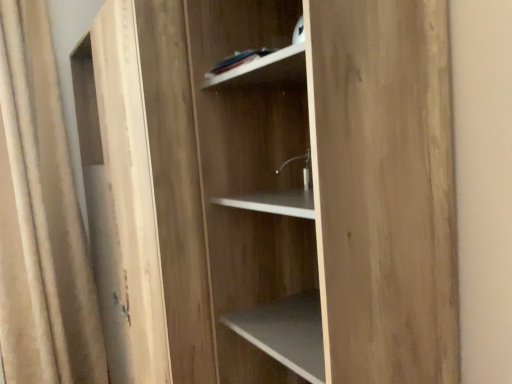
Image resolution: width=512 pixels, height=384 pixels. Find the location of `light wood cabinet at center`. light wood cabinet at center is located at coordinates (257, 193).

From a real-world perspective, is beige fabric curtain at left positioned above or below light wood cabinet at center?

beige fabric curtain at left is situated higher than light wood cabinet at center in the real world.

From the image's perspective, is beige fabric curtain at left on top of light wood cabinet at center?

Correct, beige fabric curtain at left appears higher than light wood cabinet at center in the image.

Does beige fabric curtain at left turn towards light wood cabinet at center?

No.

From the picture: Considering the sizes of objects beige fabric curtain at left and light wood cabinet at center in the image provided, who is taller, beige fabric curtain at left or light wood cabinet at center?

With more height is beige fabric curtain at left.

Find the location of `cabinet above the light wood cabinet at center (from a real-world perspective)`. cabinet above the light wood cabinet at center (from a real-world perspective) is located at coordinates (265, 71).

Is white matte shelf at upper center not within light wood cabinet at center?

white matte shelf at upper center lies outside light wood cabinet at center's area.

From the image's perspective, between white matte shelf at upper center and light wood cabinet at center, which one is located above?

From the image's view, white matte shelf at upper center is above.

Is white matte shelf at upper center far away from light wood cabinet at center?

Actually, white matte shelf at upper center and light wood cabinet at center are a little close together.

Is the position of light wood cabinet at center more distant than that of beige fabric curtain at left?

That is False.

Identify the location of cabinetry in front of the beige fabric curtain at left. (257, 193).

Between point (239, 353) and point (35, 201), which one is positioned behind?

The point (35, 201) is farther from the camera.

Considering the positions of objects light wood cabinet at center and beige fabric curtain at left in the image provided, who is more to the right, light wood cabinet at center or beige fabric curtain at left?

Positioned to the right is light wood cabinet at center.

Does light brown wood at center turn towards light wood cabinet at center?

No, light brown wood at center is not facing towards light wood cabinet at center.

Considering the relative sizes of light brown wood at center and light wood cabinet at center in the image provided, is light brown wood at center shorter than light wood cabinet at center?

Yes.

Is point (415, 336) farther from camera compared to point (247, 110)?

No, it is not.

Is white matte shelf at upper center behind beige fabric curtain at left?

No.

Is white matte shelf at upper center beside beige fabric curtain at left?

No.

Considering the relative sizes of beige fabric curtain at left and light brown wood at center in the image provided, is beige fabric curtain at left wider than light brown wood at center?

No.

From the image's perspective, is beige fabric curtain at left on light brown wood at center?

Incorrect, from the image's perspective, beige fabric curtain at left is lower than light brown wood at center.

This screenshot has height=384, width=512. In order to click on curtain that appears above the light brown wood at center (from a real-world perspective) in this screenshot , I will do click(42, 217).

Is beige fabric curtain at left next to light brown wood at center and touching it?

No, beige fabric curtain at left is not next to light brown wood at center.

Is light wood cabinet at center positioned with its back to light brown wood at center?

No, light wood cabinet at center's orientation is not away from light brown wood at center.

Is light wood cabinet at center positioned beyond the bounds of light brown wood at center?

Yes, light wood cabinet at center is not within light brown wood at center.

Which object is thinner, light wood cabinet at center or light brown wood at center?

light brown wood at center.

From a real-world perspective, which object rests below the other?

In real-world perspective, light wood cabinet at center is lower.

Locate an element on the screen. The width and height of the screenshot is (512, 384). curtain that appears on the left of light wood cabinet at center is located at coordinates (42, 217).

You are a GUI agent. You are given a task and a screenshot of the screen. Output one action in this format:
    pyautogui.click(x=<x>, y=<y>)
    Task: Click on the cabinetry below the white matte shelf at upper center (from the image's perspective)
    The width and height of the screenshot is (512, 384).
    Given the screenshot: What is the action you would take?
    pyautogui.click(x=257, y=193)

Looking at this image, considering their positions, is light brown wood at center positioned closer to white matte shelf at upper center than beige fabric curtain at left?

light brown wood at center is closer to white matte shelf at upper center.

Based on their spatial positions, is light wood cabinet at center or beige fabric curtain at left closer to light brown wood at center?

Among the two, light wood cabinet at center is located nearer to light brown wood at center.

Considering their positions, is white matte shelf at upper center positioned closer to light brown wood at center than beige fabric curtain at left?

white matte shelf at upper center.

Which object lies further to the anchor point white matte shelf at upper center, light brown wood at center or light wood cabinet at center?

light brown wood at center lies further to white matte shelf at upper center than the other object.

Estimate the real-world distances between objects in this image. Which object is closer to light wood cabinet at center, light brown wood at center or beige fabric curtain at left?

Among the two, light brown wood at center is located nearer to light wood cabinet at center.

Based on their spatial positions, is light wood cabinet at center or white matte shelf at upper center closer to light brown wood at center?

The object closer to light brown wood at center is light wood cabinet at center.

Based on their spatial positions, is beige fabric curtain at left or light wood cabinet at center closer to white matte shelf at upper center?

light wood cabinet at center is positioned closer to the anchor white matte shelf at upper center.

From the image, which object appears to be farther from beige fabric curtain at left, light wood cabinet at center or light brown wood at center?

Based on the image, light brown wood at center appears to be further to beige fabric curtain at left.

At what (x,y) coordinates should I click in order to perform the action: click on cabinet located between beige fabric curtain at left and light brown wood at center in the left-right direction. Please return your answer as a coordinate pair (x, y). This screenshot has height=384, width=512. Looking at the image, I should click on (265, 71).

Where is `cabinetry between beige fabric curtain at left and white matte shelf at upper center`? cabinetry between beige fabric curtain at left and white matte shelf at upper center is located at coordinates (257, 193).

Where is `cabinetry between beige fabric curtain at left and light brown wood at center from left to right`? The width and height of the screenshot is (512, 384). cabinetry between beige fabric curtain at left and light brown wood at center from left to right is located at coordinates (257, 193).

At what (x,y) coordinates should I click in order to perform the action: click on plywood between white matte shelf at upper center and light wood cabinet at center vertically. Please return your answer as a coordinate pair (x, y). This screenshot has height=384, width=512. Looking at the image, I should click on (385, 190).